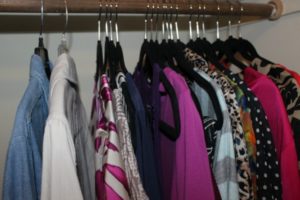
You are a GUI agent. You are given a task and a screenshot of the screen. Output one action in this format:
    pyautogui.click(x=<x>, y=<y>)
    Task: Click on the black hangers
    
    Given the screenshot: What is the action you would take?
    pyautogui.click(x=100, y=65), pyautogui.click(x=148, y=70), pyautogui.click(x=208, y=50), pyautogui.click(x=191, y=80), pyautogui.click(x=240, y=53), pyautogui.click(x=41, y=56)